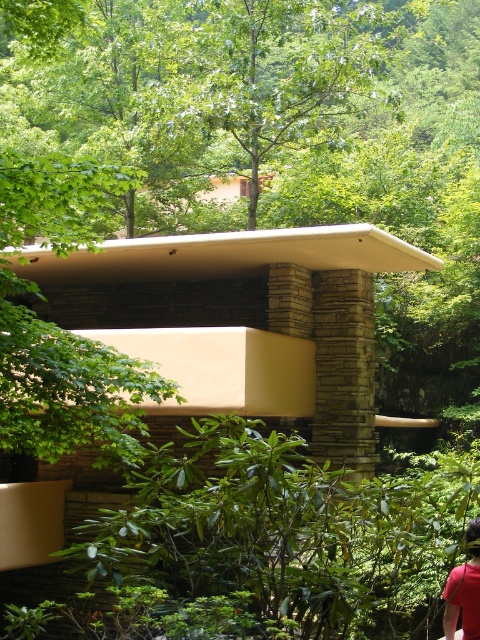
Can you confirm if beige stone shelter at center is wider than red shirt at lower right?

Yes.

This screenshot has height=640, width=480. I want to click on beige stone shelter at center, so (241, 321).

Identify the location of beige stone shelter at center. This screenshot has height=640, width=480. (241, 321).